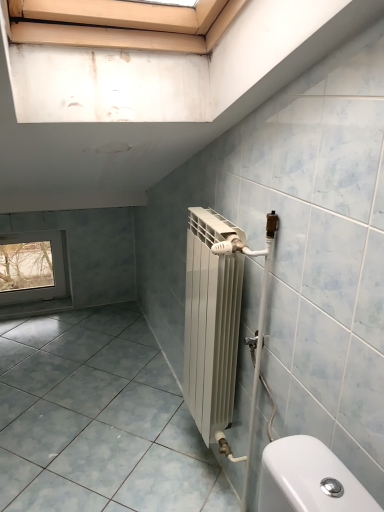
The image size is (384, 512). What do you see at coordinates (53, 265) in the screenshot?
I see `transparent glass window at lower left` at bounding box center [53, 265].

At what (x,y) coordinates should I click in order to perform the action: click on transparent glass window at lower left. Please return your answer as a coordinate pair (x, y). Looking at the image, I should click on (53, 265).

In order to face transparent glass window at lower left, should I rotate leftwards or rightwards?

A 20.637 degree turn to the left will do.

The image size is (384, 512). In order to click on matte gray tile at lower left in this screenshot , I will do `click(98, 420)`.

What do you see at coordinates (98, 420) in the screenshot? This screenshot has width=384, height=512. I see `matte gray tile at lower left` at bounding box center [98, 420].

You are a GUI agent. You are given a task and a screenshot of the screen. Output one action in this format:
    pyautogui.click(x=<x>, y=<y>)
    Task: Click on the transparent glass window at lower left
    
    Given the screenshot: What is the action you would take?
    pyautogui.click(x=53, y=265)

Between transparent glass window at lower left and matte gray tile at lower left, which one appears on the right side from the viewer's perspective?

matte gray tile at lower left is more to the right.

In the image, is transparent glass window at lower left positioned in front of or behind matte gray tile at lower left?

In the image, transparent glass window at lower left appears behind matte gray tile at lower left.

Does point (42, 292) lie in front of point (139, 428)?

No, (42, 292) is behind (139, 428).

From the image's perspective, would you say transparent glass window at lower left is shown under matte gray tile at lower left?

No.

From a real-world perspective, relative to matte gray tile at lower left, is transparent glass window at lower left vertically above or below?

Clearly, from a real-world perspective, transparent glass window at lower left is above matte gray tile at lower left.

Does transparent glass window at lower left have a lesser width compared to matte gray tile at lower left?

Indeed, transparent glass window at lower left has a lesser width compared to matte gray tile at lower left.

Based on the photo, from their relative heights in the image, would you say transparent glass window at lower left is taller or shorter than matte gray tile at lower left?

transparent glass window at lower left is taller than matte gray tile at lower left.

Can you confirm if transparent glass window at lower left is smaller than matte gray tile at lower left?

Indeed, transparent glass window at lower left has a smaller size compared to matte gray tile at lower left.

Is transparent glass window at lower left inside or outside of matte gray tile at lower left?

transparent glass window at lower left exists outside the volume of matte gray tile at lower left.

Is transparent glass window at lower left directly adjacent to matte gray tile at lower left?

No, transparent glass window at lower left is not in contact with matte gray tile at lower left.

Is transparent glass window at lower left aimed at matte gray tile at lower left?

Yes, transparent glass window at lower left is oriented towards matte gray tile at lower left.

What's the angular difference between transparent glass window at lower left and matte gray tile at lower left's facing directions?

0.633 degrees.

Locate an element on the screen. The height and width of the screenshot is (512, 384). ceramic tile located below the transparent glass window at lower left (from the image's perspective) is located at coordinates (98, 420).

Which is more to the right, matte gray tile at lower left or transparent glass window at lower left?

From the viewer's perspective, matte gray tile at lower left appears more on the right side.

Considering the positions of objects matte gray tile at lower left and transparent glass window at lower left in the image provided, who is in front, matte gray tile at lower left or transparent glass window at lower left?

matte gray tile at lower left is in front.

Considering the points (160, 417) and (38, 300), which point is in front, point (160, 417) or point (38, 300)?

Point (160, 417)

From the image's perspective, which is above, matte gray tile at lower left or transparent glass window at lower left?

From the image's view, transparent glass window at lower left is above.

From a real-world perspective, is matte gray tile at lower left over transparent glass window at lower left?

No.

Which object is wider, matte gray tile at lower left or transparent glass window at lower left?

matte gray tile at lower left.

Considering the relative sizes of matte gray tile at lower left and transparent glass window at lower left in the image provided, is matte gray tile at lower left taller than transparent glass window at lower left?

No, matte gray tile at lower left is not taller than transparent glass window at lower left.

In the scene shown: Which of these two, matte gray tile at lower left or transparent glass window at lower left, is smaller?

With smaller size is transparent glass window at lower left.

In the scene shown: Which is correct: matte gray tile at lower left is inside transparent glass window at lower left, or outside of it?

matte gray tile at lower left is located beyond the bounds of transparent glass window at lower left.

Is matte gray tile at lower left next to transparent glass window at lower left?

No, matte gray tile at lower left is not in contact with transparent glass window at lower left.

Could you tell me if matte gray tile at lower left is facing transparent glass window at lower left?

No, matte gray tile at lower left does not turn towards transparent glass window at lower left.

How many degrees apart are the facing directions of matte gray tile at lower left and transparent glass window at lower left?

0.633 degrees.

Identify the location of ceramic tile in front of the transparent glass window at lower left. Image resolution: width=384 pixels, height=512 pixels. (98, 420).

The width and height of the screenshot is (384, 512). Find the location of `ceramic tile that is on the right side of transparent glass window at lower left`. ceramic tile that is on the right side of transparent glass window at lower left is located at coordinates (98, 420).

Locate an element on the screen. ceramic tile that is below the transparent glass window at lower left (from the image's perspective) is located at coordinates (98, 420).